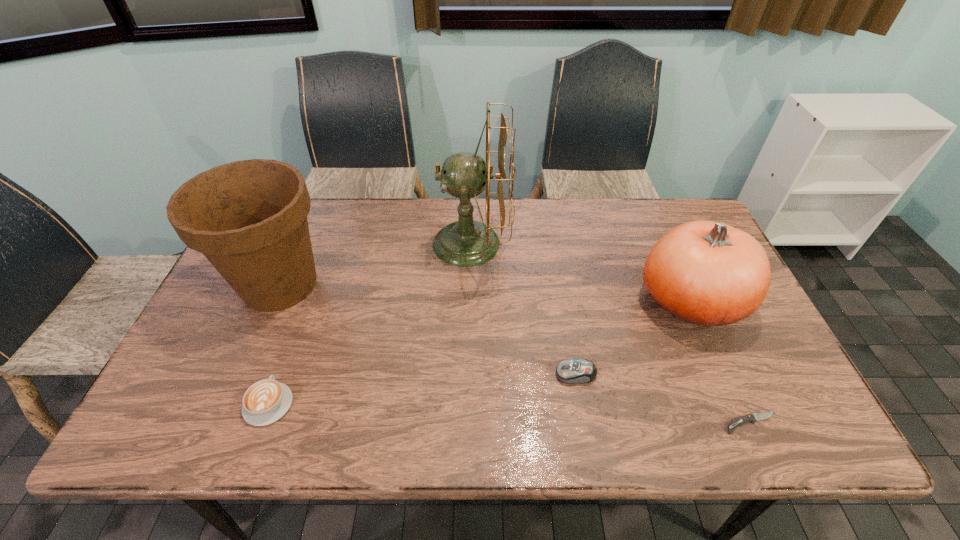
This screenshot has width=960, height=540. In order to click on vacant space located 0.400m on the side of the cappuccino with the handle in this screenshot , I will do `click(320, 263)`.

Where is `vacant space located on the side of the cappuccino with the handle`? The width and height of the screenshot is (960, 540). vacant space located on the side of the cappuccino with the handle is located at coordinates (311, 285).

What are the coordinates of `free space located 0.170m on the side of the cappuccino with the handle` in the screenshot? It's located at (298, 324).

Image resolution: width=960 pixels, height=540 pixels. What are the coordinates of `vacant position located on the wheel side of the fourth object from left to right` in the screenshot? It's located at (434, 374).

The width and height of the screenshot is (960, 540). I want to click on vacant area located on the wheel side of the fourth object from left to right, so click(x=518, y=374).

In order to click on free space located 0.350m on the wheel side of the fourth object from left to right in this screenshot , I will do `click(409, 374)`.

The height and width of the screenshot is (540, 960). What are the coordinates of `free location located on the left of the pocketknife` in the screenshot? It's located at (655, 423).

The height and width of the screenshot is (540, 960). Identify the location of object present at the far edge. (465, 243).

In order to click on cappuccino at the near edge in this screenshot , I will do `click(266, 401)`.

Identify the location of pocketknife positioned at the near edge. (754, 417).